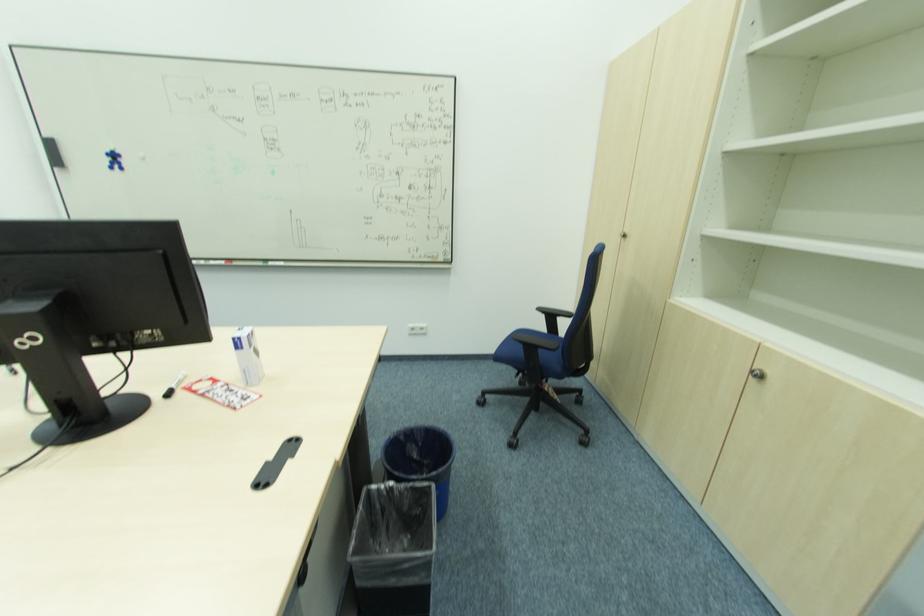
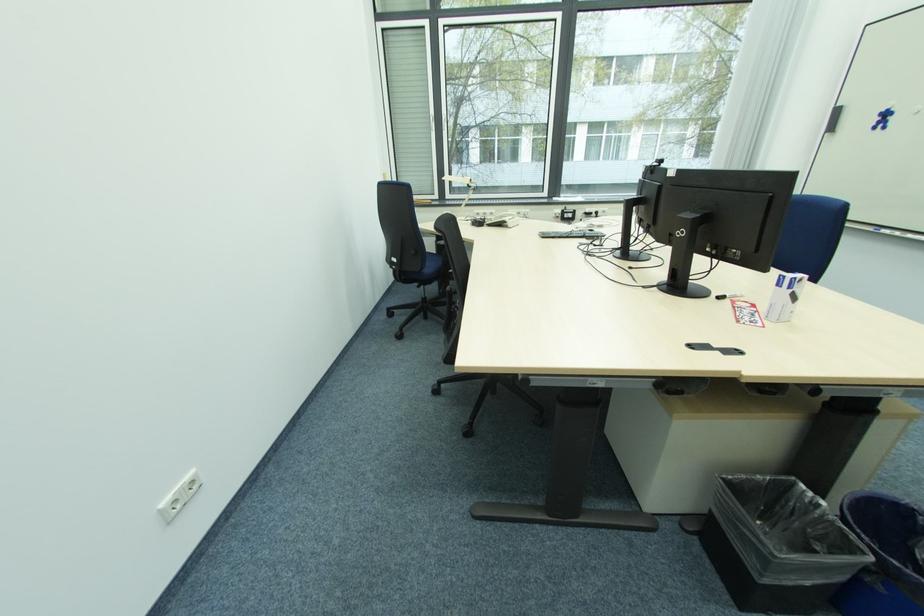
Find the pixel in the second image that matches point (247, 350) in the first image.

(784, 288)